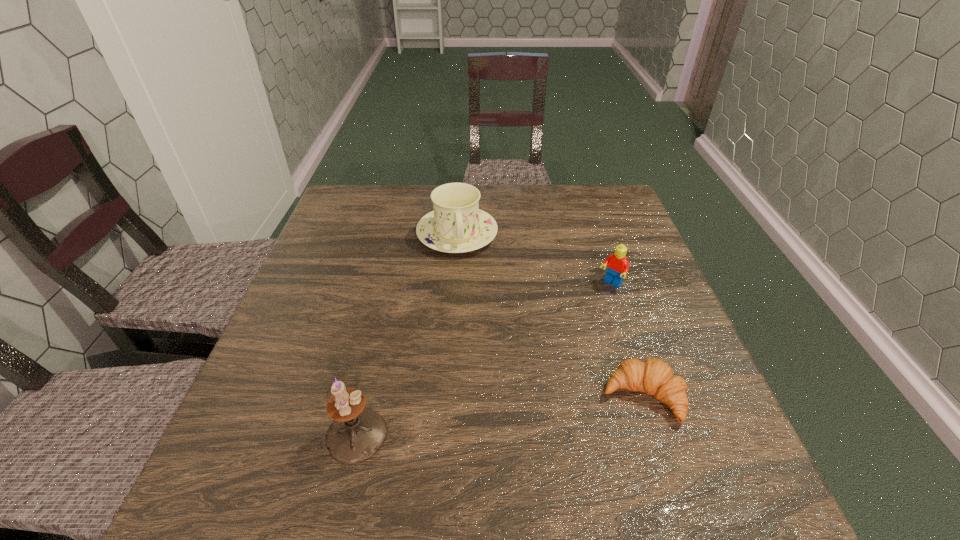
The image size is (960, 540). What are the coordinates of `candle holder` in the screenshot? It's located at (357, 433).

Identify the location of the shortest object. (653, 376).

Find the location of a particular element. The image size is (960, 540). the farthest object is located at coordinates (457, 225).

Locate an element on the screen. Lego is located at coordinates (617, 265).

At what (x,y) coordinates should I click in order to perform the action: click on vacant space located on the right of the tallest object. Please return your answer as a coordinate pair (x, y). Looking at the image, I should click on (586, 435).

Identify the location of free space located on the left of the shortest object. (418, 397).

Locate an element on the screen. Image resolution: width=960 pixels, height=540 pixels. vacant space located on the handle side of the chinaware is located at coordinates (481, 363).

Locate an element on the screen. The height and width of the screenshot is (540, 960). vacant space located on the handle side of the chinaware is located at coordinates (481, 363).

Identify the location of free space located 0.210m on the handle side of the chinaware. The width and height of the screenshot is (960, 540). (472, 317).

Locate an element on the screen. The width and height of the screenshot is (960, 540). vacant space located on the face of the third nearest object is located at coordinates (542, 360).